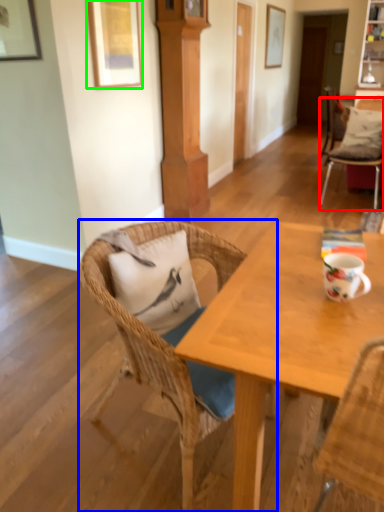
Question: Which object is positioned farthest from chair (highlighted by a red box)? Select from chair (highlighted by a blue box) and picture frame (highlighted by a green box).

Choices:
 (A) chair
 (B) picture frame

Answer: (A)